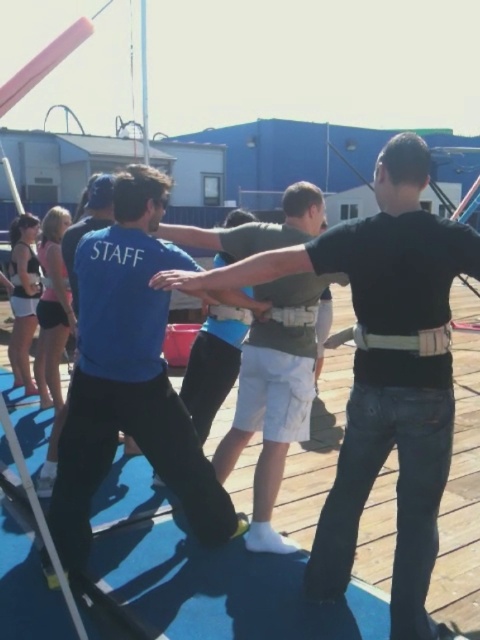
Question: Which of the following is the farthest from the observer?

Choices:
 (A) black matte shirt at center
 (B) matte black tank top at left

Answer: (B)

Question: Is black matte shirt at center smaller than matte black tank top at left?

Choices:
 (A) no
 (B) yes

Answer: (A)

Question: Is black matte shirt at center closer to the viewer compared to matte black tank top at left?

Choices:
 (A) no
 (B) yes

Answer: (B)

Question: Does blue fabric shirt at center have a larger size compared to matte black tank top at left?

Choices:
 (A) no
 (B) yes

Answer: (B)

Question: Which point is closer to the camera?

Choices:
 (A) (75, 477)
 (B) (362, 228)

Answer: (B)

Question: Among these points, which one is nearest to the camera?

Choices:
 (A) (13, 225)
 (B) (58, 476)
 (C) (411, 161)

Answer: (C)